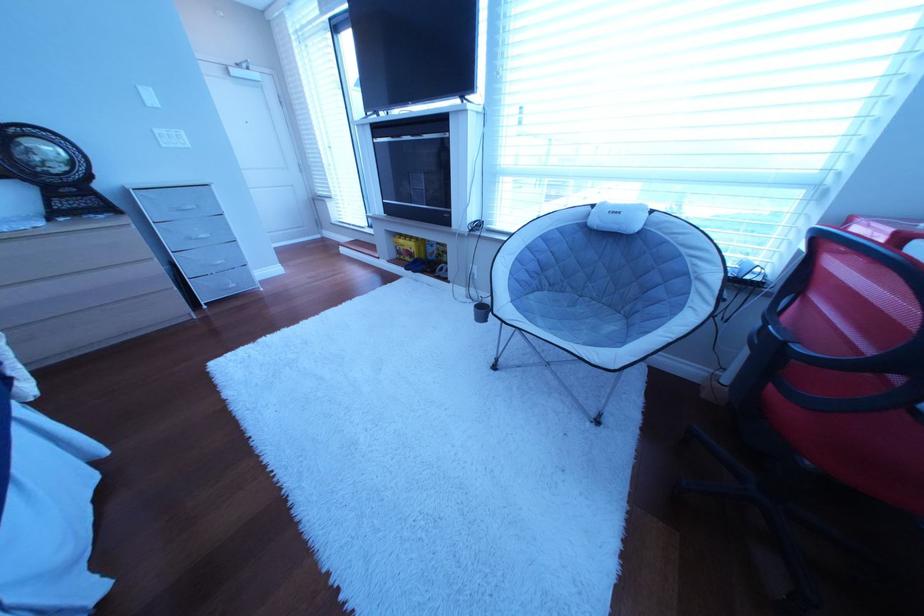
Find where to press the light switch. Please return your answer as a coordinate pair (x, y).

(171, 138)